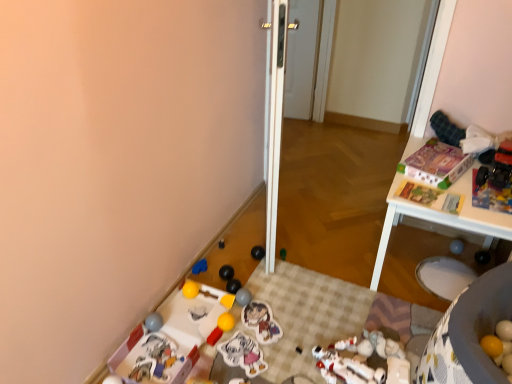
Where is `free space between matte plastic sticker at center, marked as the seventh toy in a right-to-left arrangement, and white matte robot at lower center, which is the 5th toy from right to left`? Image resolution: width=512 pixels, height=384 pixels. free space between matte plastic sticker at center, marked as the seventh toy in a right-to-left arrangement, and white matte robot at lower center, which is the 5th toy from right to left is located at coordinates (292, 340).